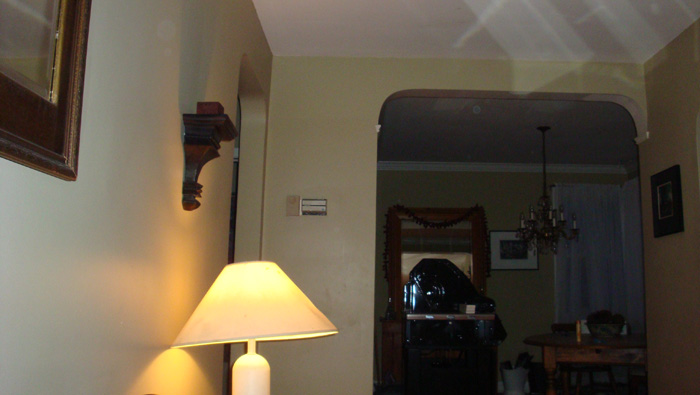
Locate an element on the screen. Image resolution: width=700 pixels, height=395 pixels. lampshade is located at coordinates (244, 320).